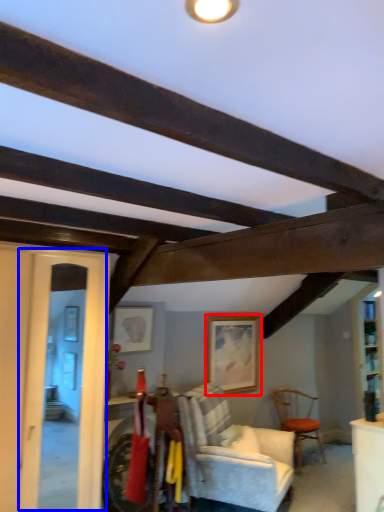
Question: Which object is further to the camera taking this photo, picture frame (highlighted by a red box) or glass door (highlighted by a blue box)?

Choices:
 (A) picture frame
 (B) glass door

Answer: (A)